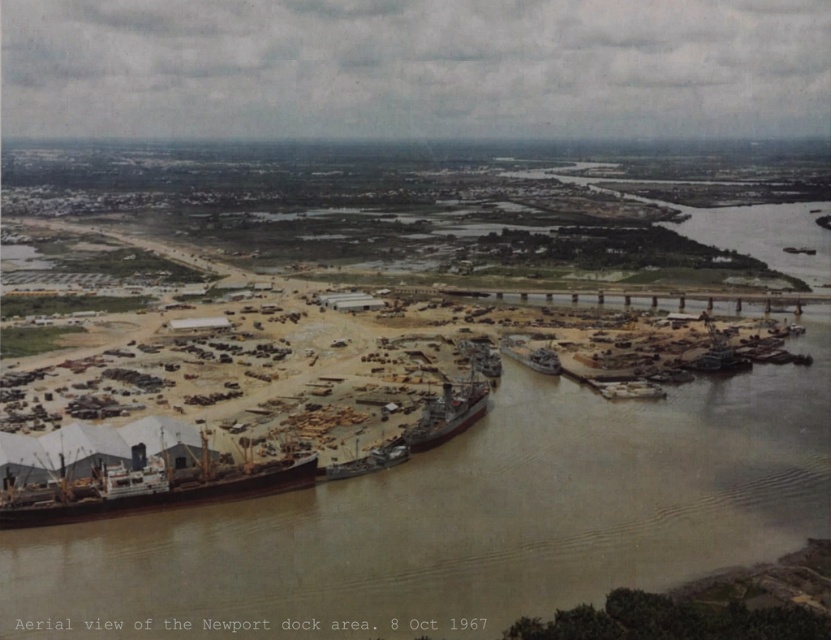
You are a crane operator at the Newport dock area and need to load a large cargo container onto a boat. Based on the scene, which boat would be more suitable for this task, the brown wooden boat at lower left or the wooden planks boat at lower right?

The brown wooden boat at lower left is more suitable for loading the large cargo container because it has a larger size compared to the wooden planks boat at lower right.